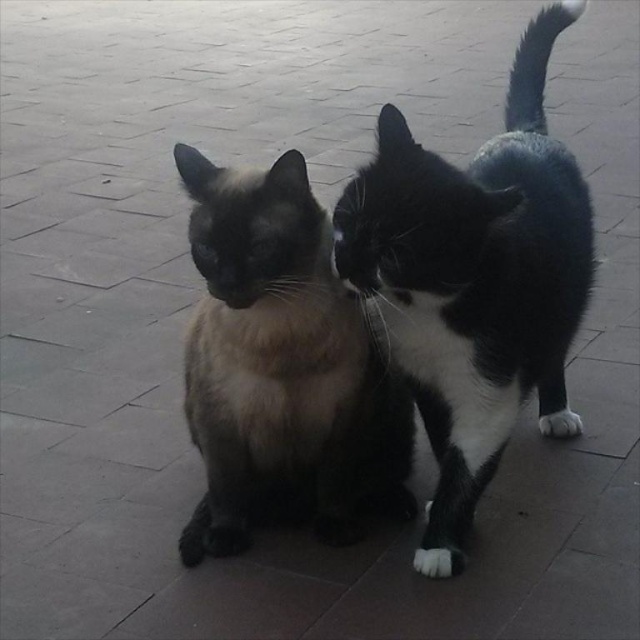
You are a photographer trying to capture a clear shot of both the black and white fur cat at right and the smokey fur cat at center. Based on their positions, which cat might be partially obscured in the photo?

The smokey fur cat at center might be partially obscured because the black and white fur cat at right is positioned over it.

You are a photographer trying to capture both cats in a single shot. You notice two points marked in the image. The first point is at coordinate point [552,42] and the second is at point [372,419]. Since you want to ensure both cats are in focus, which point should you focus on to maximize the chances of both cats being sharp in the photo?

You should focus on point [372,419] because it is closer to the viewer than point [552,42]. Focusing on the closer point will ensure that the area of sharpness extends further back, potentially covering both cats.